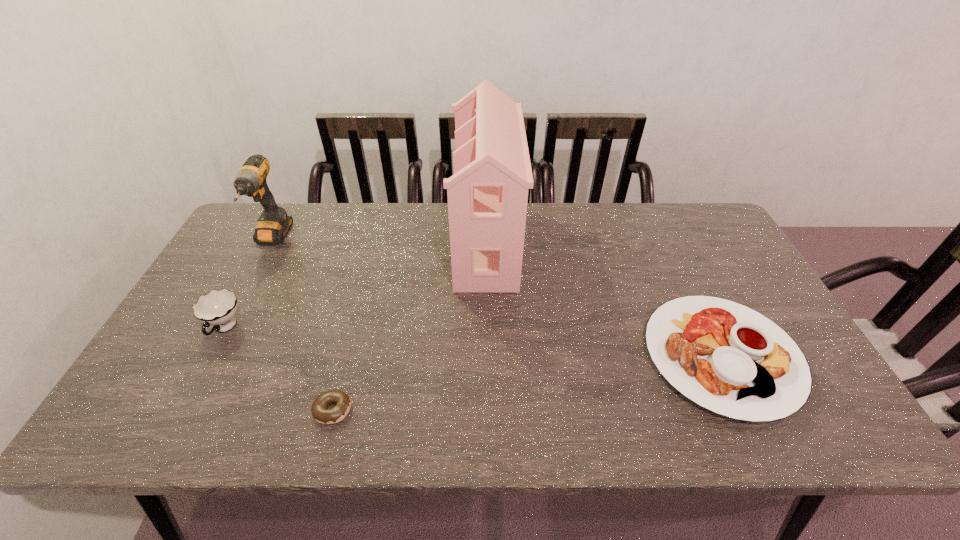
Identify the location of the fourth object from left to right. (487, 196).

The image size is (960, 540). Identify the location of the tallest object. (487, 196).

At what (x,y) coordinates should I click in order to perform the action: click on the fourth shortest object. Please return your answer as a coordinate pair (x, y). This screenshot has height=540, width=960. Looking at the image, I should click on (273, 224).

Image resolution: width=960 pixels, height=540 pixels. Find the location of `cup`. cup is located at coordinates (217, 308).

The width and height of the screenshot is (960, 540). What are the coordinates of `platter` in the screenshot? It's located at pyautogui.click(x=726, y=357).

What are the coordinates of `the second shortest object` in the screenshot? It's located at (726, 357).

Locate an element on the screen. The width and height of the screenshot is (960, 540). the third object from left to right is located at coordinates (320, 412).

At what (x,y) coordinates should I click in order to perform the action: click on the shortest object. Please return your answer as a coordinate pair (x, y). Image resolution: width=960 pixels, height=540 pixels. Looking at the image, I should click on click(320, 412).

Find the location of a particular element. This screenshot has width=960, height=540. free region located on the front-facing side of the fourth object from left to right is located at coordinates (400, 244).

The height and width of the screenshot is (540, 960). What are the coordinates of `free space located on the front-facing side of the fourth object from left to right` in the screenshot? It's located at (403, 244).